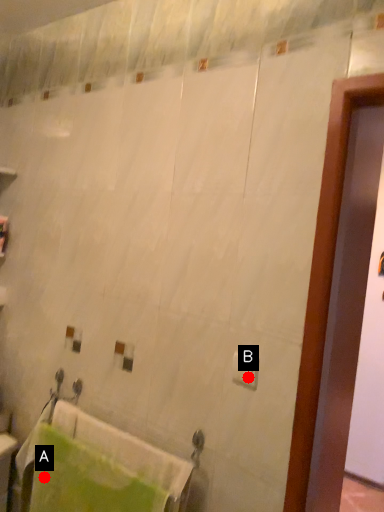
Question: Two points are circled on the image, labeled by A and B beside each circle. Among these points, which one is farthest from the camera?

Choices:
 (A) A is further
 (B) B is further

Answer: (A)